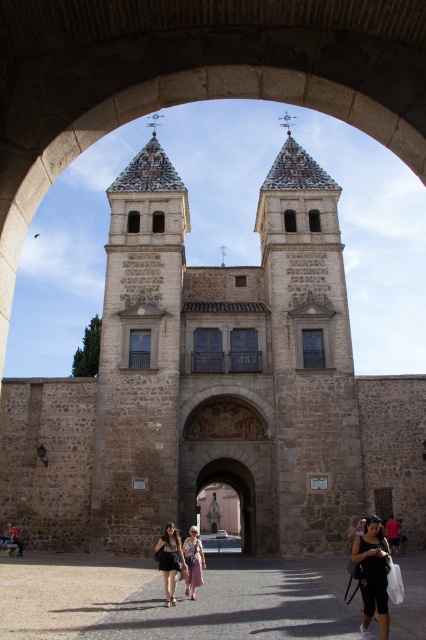
Question: Which point is farther to the camera?

Choices:
 (A) (172, 566)
 (B) (215, 470)

Answer: (B)

Question: Does gray stone church at center appear over black fabric dress at center?

Choices:
 (A) no
 (B) yes

Answer: (B)

Question: Is matte black bag at lower right to the right of black fabric dress at center from the viewer's perspective?

Choices:
 (A) yes
 (B) no

Answer: (A)

Question: Does matte black bag at lower right appear on the right side of light pink fabric skirt at center?

Choices:
 (A) no
 (B) yes

Answer: (B)

Question: Which of these objects is positioned farthest from the black fabric dress at center?

Choices:
 (A) matte black bag at lower right
 (B) gray stone church at center

Answer: (B)

Question: Which point is farther to the camera?

Choices:
 (A) (143, 256)
 (B) (173, 563)
 (C) (195, 545)

Answer: (A)